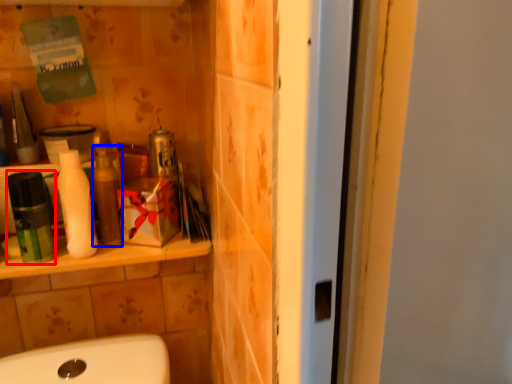
Question: Which point is closer to the camera, mouthwash (highlighted by a red box) or toiletry (highlighted by a blue box)?

Choices:
 (A) mouthwash
 (B) toiletry

Answer: (A)